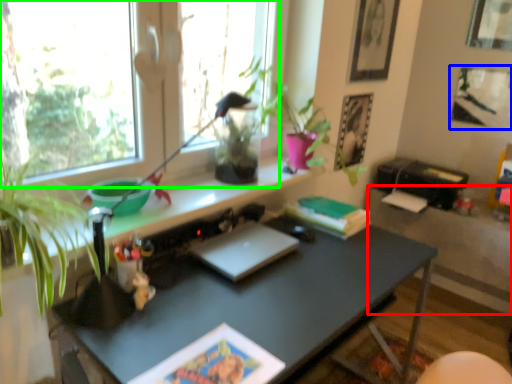
Question: Estimate the real-world distances between objects in this image. Which object is farther from table (highlighted by a red box), picture frame (highlighted by a blue box) or window (highlighted by a green box)?

Choices:
 (A) picture frame
 (B) window

Answer: (B)